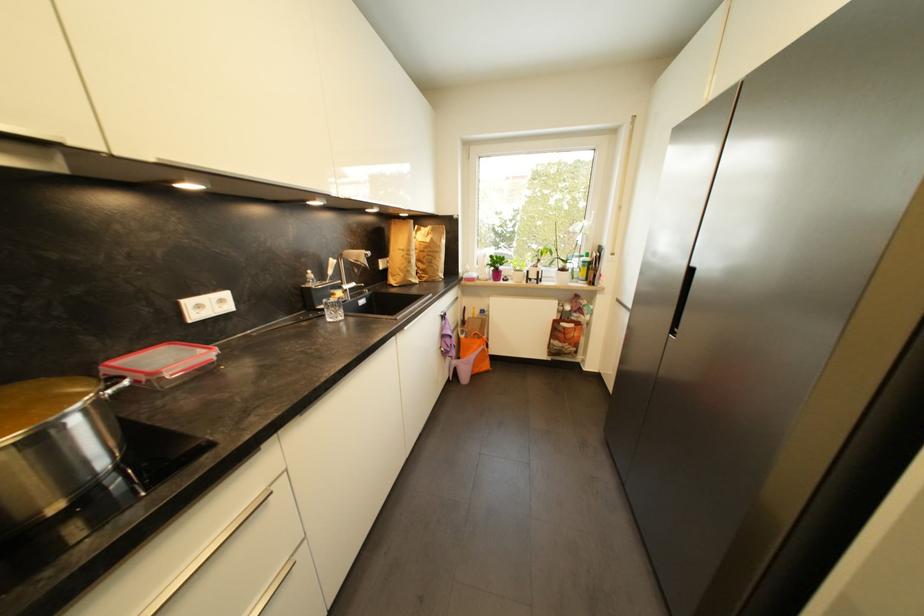
Where is `red container clip`? red container clip is located at coordinates (186, 363).